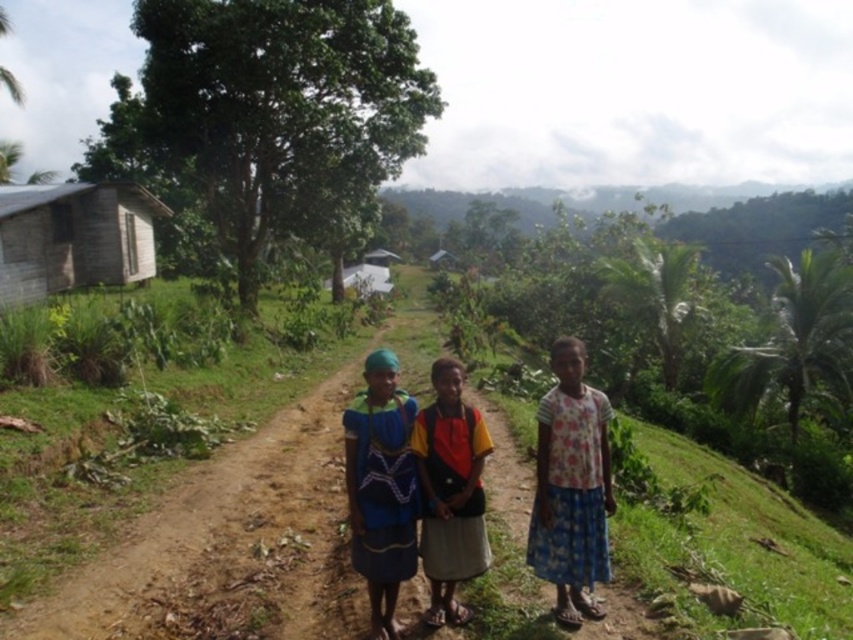
Question: Is blue woven fabric dress at center positioned before multicolored fabric skirt at center?

Choices:
 (A) yes
 (B) no

Answer: (A)

Question: Estimate the real-world distances between objects in this image. Which object is farther from the floral fabric skirt at center?

Choices:
 (A) brown dirt path at center
 (B) multicolored fabric skirt at center
 (C) blue woven fabric dress at center
 (D) weathered wood hut at upper left

Answer: (D)

Question: Which point is closer to the camera?

Choices:
 (A) brown dirt path at center
 (B) multicolored fabric skirt at center
 (C) blue woven fabric dress at center

Answer: (C)

Question: Estimate the real-world distances between objects in this image. Which object is farther from the weathered wood hut at upper left?

Choices:
 (A) blue woven fabric dress at center
 (B) multicolored fabric skirt at center
 (C) floral fabric skirt at center
 (D) brown dirt path at center

Answer: (A)

Question: Does floral fabric skirt at center have a lesser width compared to weathered wood hut at upper left?

Choices:
 (A) no
 (B) yes

Answer: (B)

Question: Is brown dirt path at center above weathered wood hut at upper left?

Choices:
 (A) yes
 (B) no

Answer: (B)